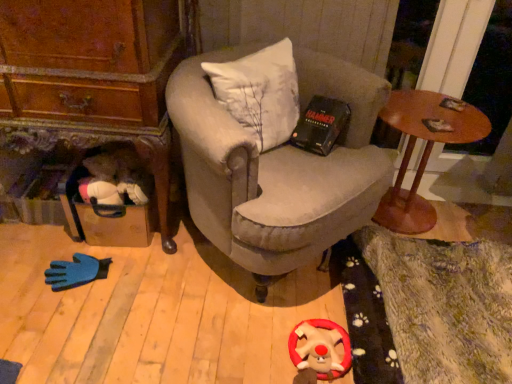
Question: Considering the relative positions of wooden round table at right and velvet gray armchair at center in the image provided, is wooden round table at right to the left of velvet gray armchair at center from the viewer's perspective?

Choices:
 (A) no
 (B) yes

Answer: (A)

Question: Are wooden round table at right and velvet gray armchair at center located far from each other?

Choices:
 (A) no
 (B) yes

Answer: (A)

Question: Is wooden round table at right oriented towards velvet gray armchair at center?

Choices:
 (A) yes
 (B) no

Answer: (B)

Question: Does wooden round table at right appear on the right side of velvet gray armchair at center?

Choices:
 (A) no
 (B) yes

Answer: (B)

Question: Is wooden round table at right further to camera compared to velvet gray armchair at center?

Choices:
 (A) no
 (B) yes

Answer: (B)

Question: Is point (254, 147) positioned closer to the camera than point (335, 367)?

Choices:
 (A) closer
 (B) farther

Answer: (B)

Question: Is velvet gray armchair at center situated inside velvety red plush reindeer at lower center or outside?

Choices:
 (A) outside
 (B) inside

Answer: (A)

Question: Looking at the image, does velvet gray armchair at center seem bigger or smaller compared to velvety red plush reindeer at lower center?

Choices:
 (A) small
 (B) big

Answer: (B)

Question: From a real-world perspective, relative to velvety red plush reindeer at lower center, is velvet gray armchair at center vertically above or below?

Choices:
 (A) above
 (B) below

Answer: (A)

Question: Would you say velvety red plush reindeer at lower center is to the left or to the right of wooden round table at right in the picture?

Choices:
 (A) left
 (B) right

Answer: (A)

Question: Considering the positions of velvety red plush reindeer at lower center and wooden round table at right in the image, is velvety red plush reindeer at lower center taller or shorter than wooden round table at right?

Choices:
 (A) short
 (B) tall

Answer: (A)

Question: In terms of width, does velvety red plush reindeer at lower center look wider or thinner when compared to wooden round table at right?

Choices:
 (A) wide
 (B) thin

Answer: (B)

Question: From a real-world perspective, is velvety red plush reindeer at lower center physically located above or below wooden round table at right?

Choices:
 (A) above
 (B) below

Answer: (B)

Question: Is wooden round table at right spatially inside velvet gray armchair at center, or outside of it?

Choices:
 (A) inside
 (B) outside

Answer: (B)

Question: From a real-world perspective, is wooden round table at right positioned above or below velvet gray armchair at center?

Choices:
 (A) below
 (B) above

Answer: (A)